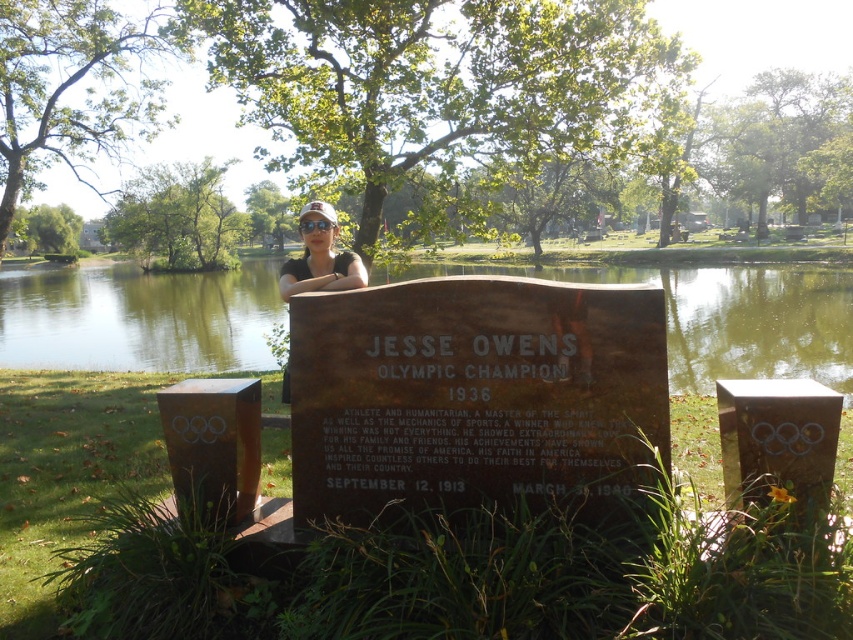
Can you confirm if green water at pond center is bigger than matte black cap at upper center?

Yes, green water at pond center is bigger than matte black cap at upper center.

Is point (80, 353) closer to viewer compared to point (312, 260)?

That is False.

Between point (691, 340) and point (314, 282), which one is positioned in front?

Point (314, 282) is in front.

Locate an element on the screen. green water at pond center is located at coordinates (138, 317).